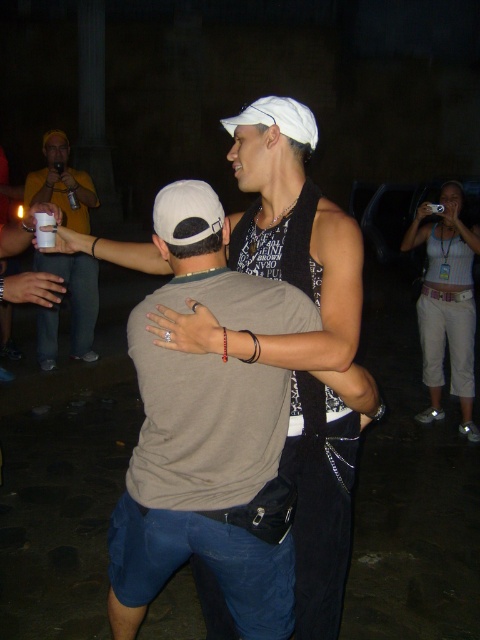
Is white matte cap at center above white cotton tank top at upper right?

No.

Is white matte cap at center positioned behind white cotton tank top at upper right?

No, white matte cap at center is in front of white cotton tank top at upper right.

Who is more distant from viewer, (300, 484) or (452, 225)?

Point (452, 225)

You are a GUI agent. You are given a task and a screenshot of the screen. Output one action in this format:
    pyautogui.click(x=<x>, y=<y>)
    Task: Click on the white matte cap at center
    The height and width of the screenshot is (640, 480).
    Given the screenshot: What is the action you would take?
    pyautogui.click(x=296, y=337)

Measure the distance from white cotton tank top at upper right to matte yellow shirt at left.

9.32 feet

Looking at this image, who is more distant from viewer, [420,211] or [94,310]?

Point [94,310]

Is point (476, 228) more distant than point (46, 180)?

No, it is not.

I want to click on white cotton tank top at upper right, so click(446, 304).

Who is more distant from viewer, (x=284, y=241) or (x=91, y=346)?

Positioned behind is point (x=91, y=346).

Which is in front, point (267, 266) or point (50, 164)?

Point (267, 266) is more forward.

Find the location of a particular element. white matte cap at center is located at coordinates (296, 337).